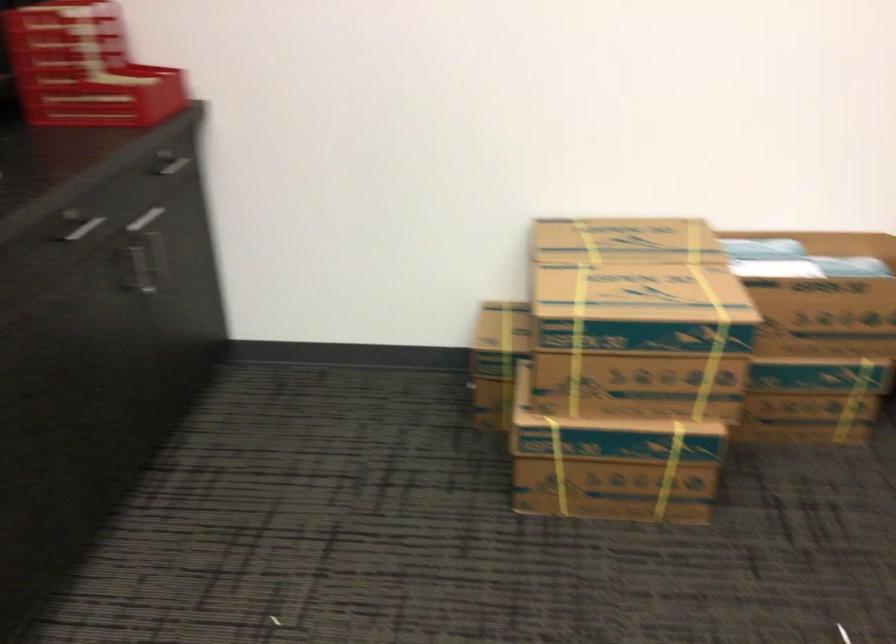
Where would you pull the silver drawer handle? Please return your answer as a coordinate pair (x, y).

(154, 258)